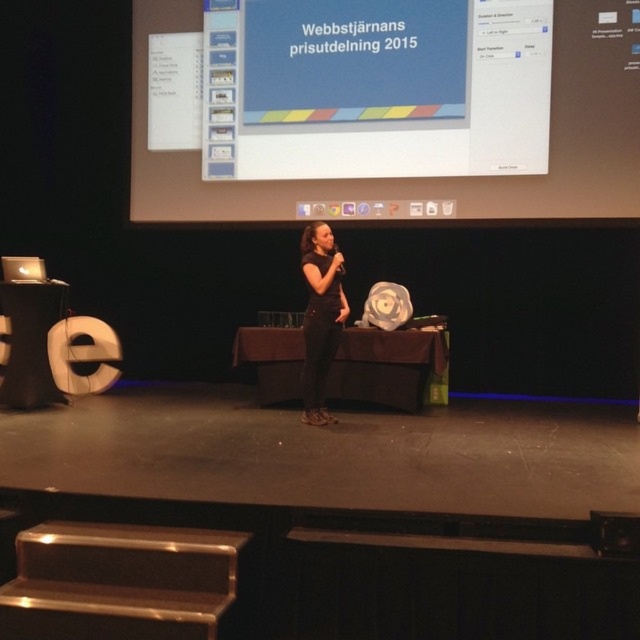
You are an event planner who needs to ensure the speaker can see the screen clearly. Given that the speaker must stand at least 2 meters away from the screen to avoid blocking the audience view, is the current distance between the white glossy projection screen at upper center and the black matte dress at center sufficient?

The distance between the white glossy projection screen at upper center and the black matte dress at center is 2.67 meters, which is greater than the required 2 meters. Therefore, the current distance is sufficient for the speaker to see the screen clearly without blocking the audience view.

You are an event organizer who needs to ensure the white glossy projection screen at upper center and the black matte dress at center are visible to the audience. Based on their sizes, which one might be harder to see from the back of the room?

The white glossy projection screen at upper center has a smaller size compared to the black matte dress at center, so the projection screen might be harder to see from the back of the room.

You are an attendee at the event and want to take a photo of the speaker without the screen in the background. Since you are standing in the audience, can you angle your camera downward to avoid the white glossy projection screen at upper center behind the black matte dress at center?

The white glossy projection screen at upper center is located above the black matte dress at center, so angling the camera downward would help avoid capturing the screen in the background.